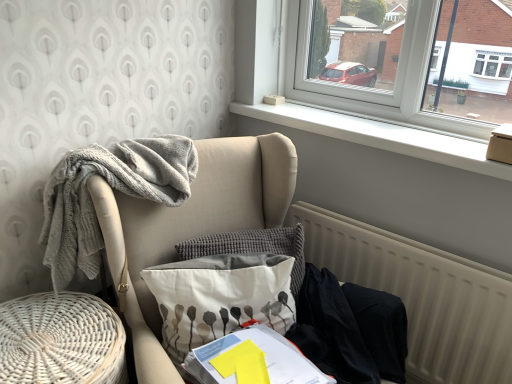
Question: Is white smooth window sill at upper center in front of beige textured radiator at lower right?

Choices:
 (A) yes
 (B) no

Answer: (B)

Question: Is white smooth window sill at upper center facing away from beige textured radiator at lower right?

Choices:
 (A) yes
 (B) no

Answer: (B)

Question: From the image's perspective, would you say white smooth window sill at upper center is positioned over beige textured radiator at lower right?

Choices:
 (A) no
 (B) yes

Answer: (B)

Question: From a real-world perspective, is white smooth window sill at upper center physically below beige textured radiator at lower right?

Choices:
 (A) no
 (B) yes

Answer: (A)

Question: From the image's perspective, is white smooth window sill at upper center under beige textured radiator at lower right?

Choices:
 (A) yes
 (B) no

Answer: (B)

Question: Does white smooth window sill at upper center have a greater height compared to beige textured radiator at lower right?

Choices:
 (A) no
 (B) yes

Answer: (A)

Question: Does beige textured radiator at lower right come in front of white smooth window sill at upper center?

Choices:
 (A) no
 (B) yes

Answer: (B)

Question: Is beige textured radiator at lower right facing towards white smooth window sill at upper center?

Choices:
 (A) no
 (B) yes

Answer: (A)

Question: Are beige textured radiator at lower right and white smooth window sill at upper center far apart?

Choices:
 (A) no
 (B) yes

Answer: (A)

Question: From the image's perspective, does beige textured radiator at lower right appear higher than white smooth window sill at upper center?

Choices:
 (A) yes
 (B) no

Answer: (B)

Question: From a real-world perspective, is beige textured radiator at lower right beneath white smooth window sill at upper center?

Choices:
 (A) yes
 (B) no

Answer: (A)

Question: From a real-world perspective, is beige textured radiator at lower right located higher than white smooth window sill at upper center?

Choices:
 (A) no
 (B) yes

Answer: (A)

Question: Is white woven basket at lower left far from white smooth window sill at upper center?

Choices:
 (A) no
 (B) yes

Answer: (B)